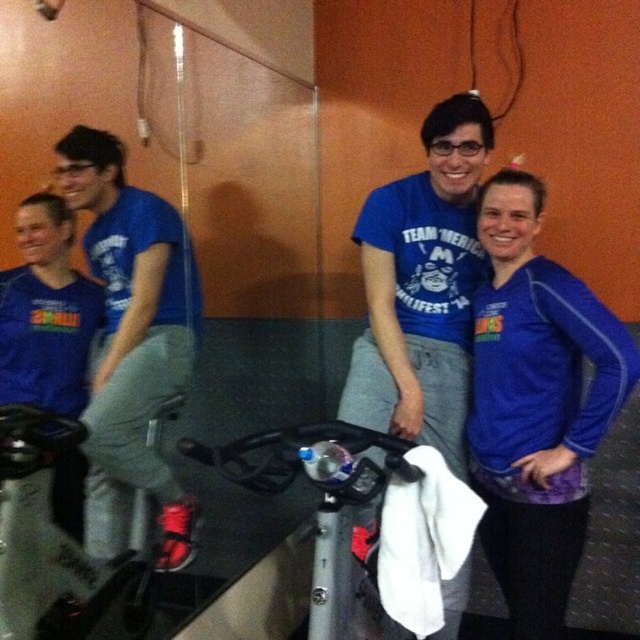
You are standing at the point marked as point (182, 516). You need to reach the door located at the opposite side of the room. The shortest path requires moving through a narrow corridor that is 6 feet wide. Can you safely navigate through this corridor without any obstacles?

The distance between you and the door is 7.16 feet. The corridor is 6 feet wide, so you can safely navigate through it as the distance is sufficient.